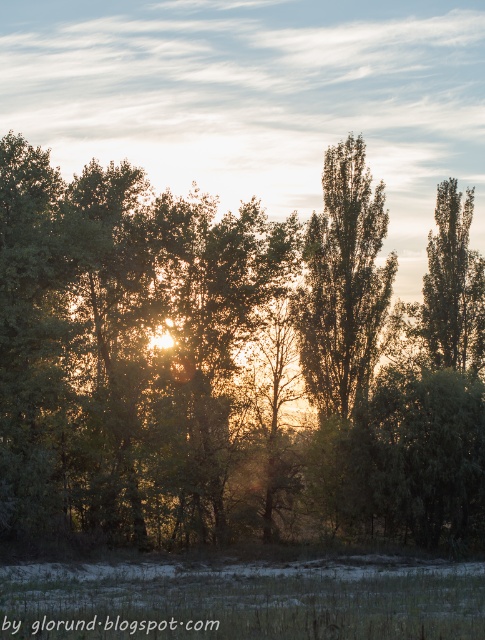
Does green leafy tree at center appear on the left side of green grass at lower center?

In fact, green leafy tree at center is to the right of green grass at lower center.

Which is more to the left, green leafy tree at center or green grass at lower center?

Positioned to the left is green grass at lower center.

The height and width of the screenshot is (640, 485). I want to click on green leafy tree at center, so click(x=231, y=364).

Find the location of a particular element. green leafy tree at center is located at coordinates 231,364.

Does green grass at lower center appear under green leafy tree at upper right?

Yes, green grass at lower center is below green leafy tree at upper right.

Is green grass at lower center smaller than green leafy tree at upper right?

Incorrect, green grass at lower center is not smaller in size than green leafy tree at upper right.

Describe the element at coordinates (243, 600) in the screenshot. I see `green grass at lower center` at that location.

The width and height of the screenshot is (485, 640). In order to click on green grass at lower center in this screenshot , I will do `click(243, 600)`.

Between point (182, 257) and point (436, 253), which one is positioned in front?

Point (182, 257) is more forward.

Can you confirm if green leafy tree at center is positioned to the right of green leafy tree at upper right?

In fact, green leafy tree at center is to the left of green leafy tree at upper right.

Which is behind, point (269, 282) or point (407, 308)?

Positioned behind is point (407, 308).

At what (x,y) coordinates should I click in order to perform the action: click on green leafy tree at center. Please return your answer as a coordinate pair (x, y). Looking at the image, I should click on (231, 364).